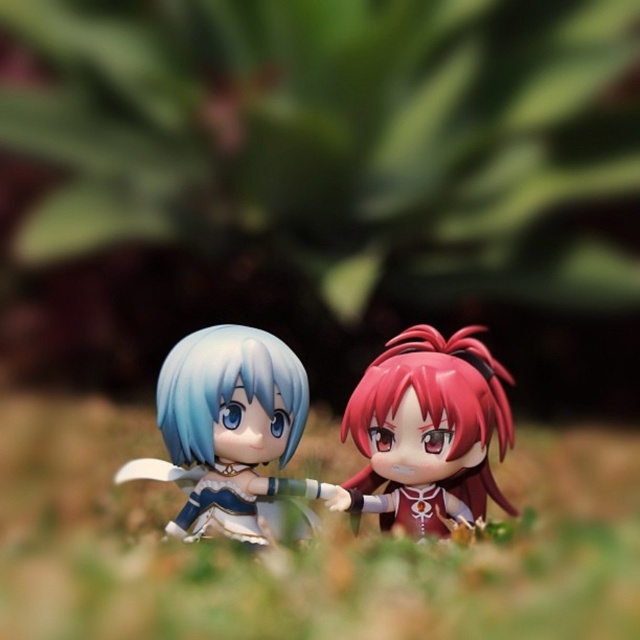
Is point (385, 528) positioned before point (248, 332)?

No, it is behind (248, 332).

Can you confirm if satin red hair at center is wider than satin white doll at center?

No.

Does point (467, 433) lie in front of point (259, 538)?

Yes, point (467, 433) is in front of point (259, 538).

The image size is (640, 640). I want to click on satin red hair at center, so click(x=428, y=432).

Is green grass at center in front of satin white doll at center?

That is True.

What are the coordinates of `green grass at center` in the screenshot? It's located at (304, 547).

Which is below, satin red hair at center or semi-glossy blue hair at center?

Positioned lower is satin red hair at center.

Between satin red hair at center and semi-glossy blue hair at center, which one has more height?

Standing taller between the two is satin red hair at center.

The image size is (640, 640). What do you see at coordinates (428, 432) in the screenshot?
I see `satin red hair at center` at bounding box center [428, 432].

At what (x,y) coordinates should I click in order to perform the action: click on satin red hair at center. Please return your answer as a coordinate pair (x, y). Looking at the image, I should click on (428, 432).